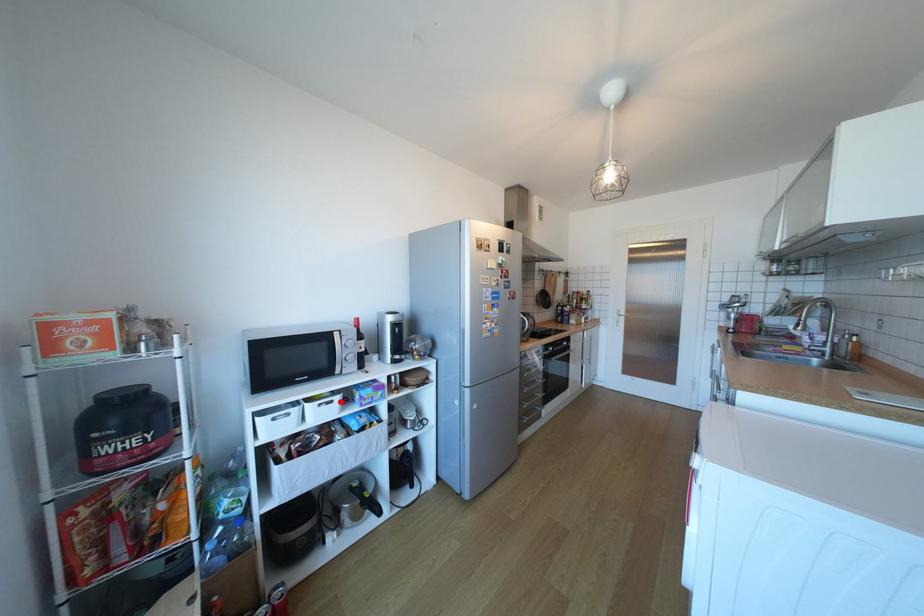
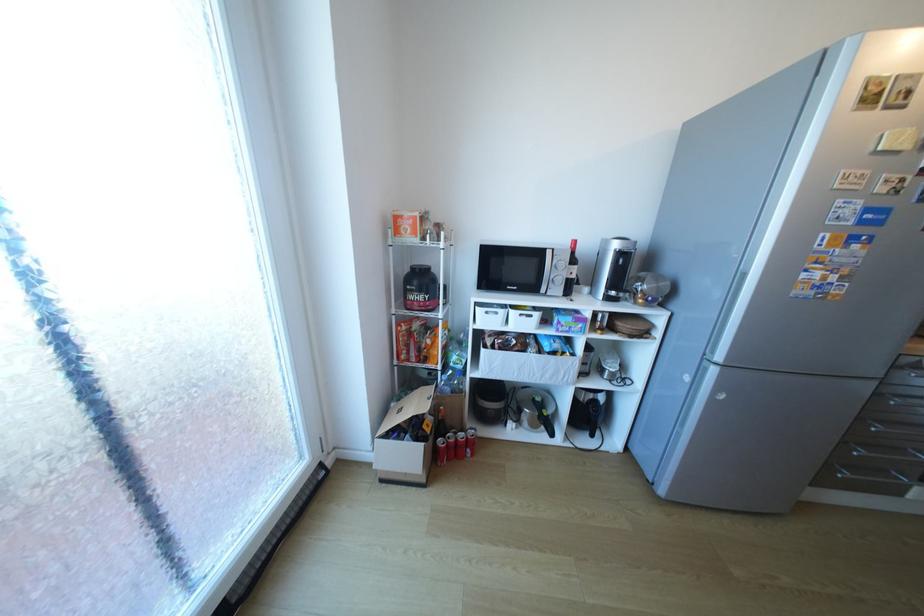
Find the pixel in the second image that matches the highlighted location in the first image.

(540, 315)